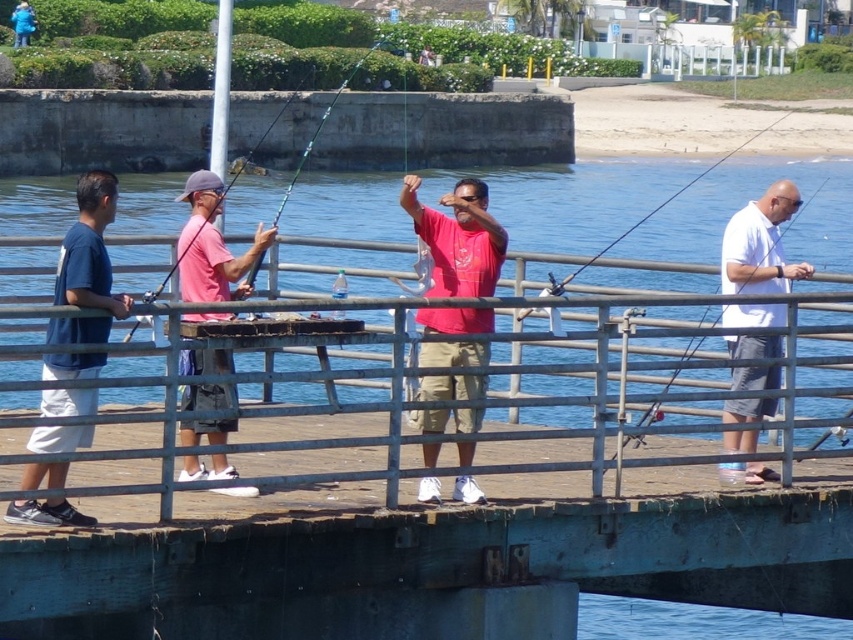
Is white matte shirt at right thinner than matte white fishing pole at right?

Correct, white matte shirt at right's width is less than matte white fishing pole at right's.

Is point (767, 228) positioned in front of point (776, 193)?

That is True.

Is point (764, 257) farther from viewer compared to point (741, 209)?

No, (764, 257) is closer to viewer.

This screenshot has height=640, width=853. I want to click on white matte shirt at right, so coord(759,244).

Does blue water at center have a greater height compared to blue fabric jacket at upper left?

Correct, blue water at center is much taller as blue fabric jacket at upper left.

Who is more distant from viewer, (x=263, y=196) or (x=18, y=42)?

Point (x=18, y=42)

Who is more forward, (x=688, y=227) or (x=16, y=12)?

Point (x=688, y=227) is in front.

Locate an element on the screen. blue water at center is located at coordinates (743, 204).

Is point (340, 90) positioned after point (27, 10)?

No.

Can you confirm if teal glossy fishing pole at center is bigger than blue fabric jacket at upper left?

Indeed, teal glossy fishing pole at center has a larger size compared to blue fabric jacket at upper left.

Image resolution: width=853 pixels, height=640 pixels. What are the coordinates of `teal glossy fishing pole at center` in the screenshot? It's located at (322, 125).

The height and width of the screenshot is (640, 853). Find the location of `teal glossy fishing pole at center`. teal glossy fishing pole at center is located at coordinates (322, 125).